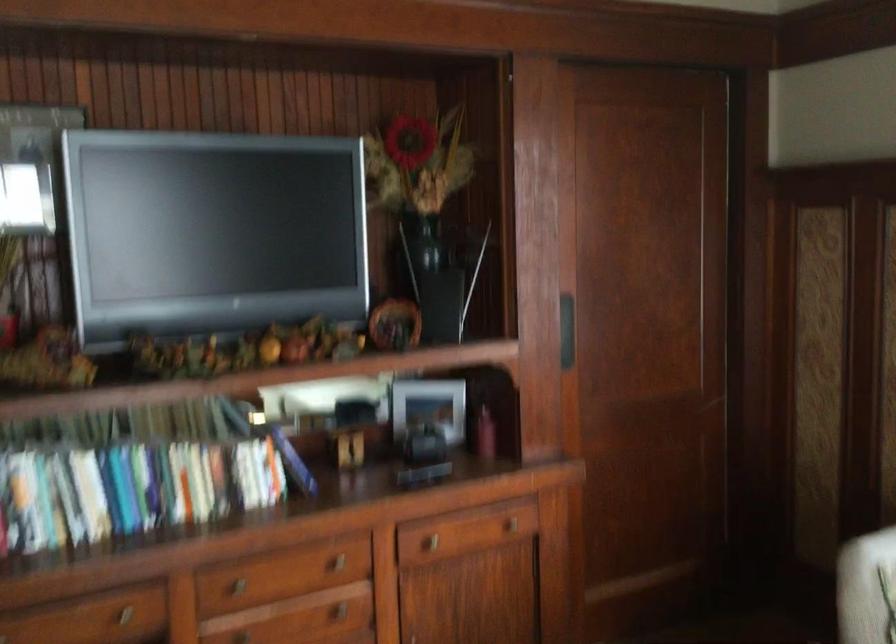
Locate an element on the screen. black flower vase is located at coordinates (433, 278).